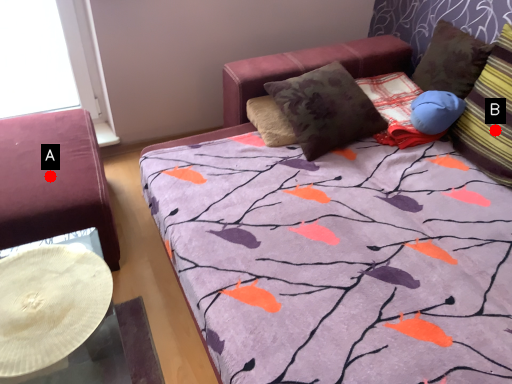
Question: Two points are circled on the image, labeled by A and B beside each circle. Which point appears farthest from the camera in this image?

Choices:
 (A) A is further
 (B) B is further

Answer: (B)